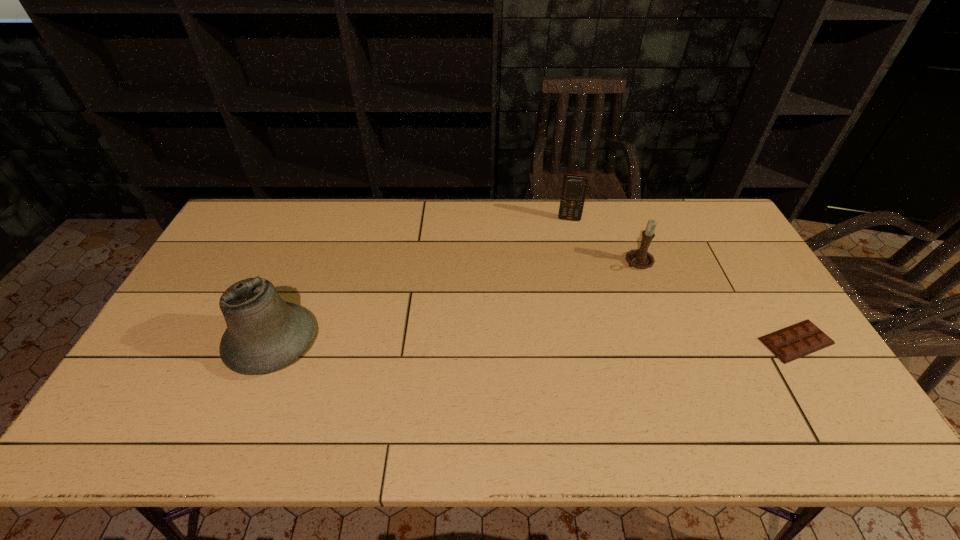
This screenshot has width=960, height=540. In order to click on vacant space at the near edge in this screenshot , I will do `click(196, 404)`.

This screenshot has height=540, width=960. Identify the location of vacant area at the left edge. (172, 319).

Locate an element on the screen. This screenshot has width=960, height=540. vacant region at the right edge of the desktop is located at coordinates (726, 289).

The width and height of the screenshot is (960, 540). In the image, there is a desktop. In order to click on free space at the far left corner in this screenshot , I will do `click(255, 213)`.

In the image, there is a desktop. Where is `free space at the far right corner`? This screenshot has height=540, width=960. free space at the far right corner is located at coordinates (703, 219).

Find the location of a particular element. The height and width of the screenshot is (540, 960). free space between the chocolate bar and the second object from left to right is located at coordinates (683, 280).

The width and height of the screenshot is (960, 540). Find the location of `free space between the farthest object and the leftmost object`. free space between the farthest object and the leftmost object is located at coordinates (420, 281).

You are a GUI agent. You are given a task and a screenshot of the screen. Output one action in this format:
    pyautogui.click(x=<x>, y=<y>)
    Task: Click on the empty space that is in between the tallest object and the cellular telephone
    The width and height of the screenshot is (960, 540).
    Given the screenshot: What is the action you would take?
    pyautogui.click(x=420, y=281)

The width and height of the screenshot is (960, 540). In order to click on unoccupied area between the shortest object and the bell in this screenshot , I will do `click(534, 342)`.

Identify the location of empty space that is in between the leftmost object and the third object from right to left. (420, 281).